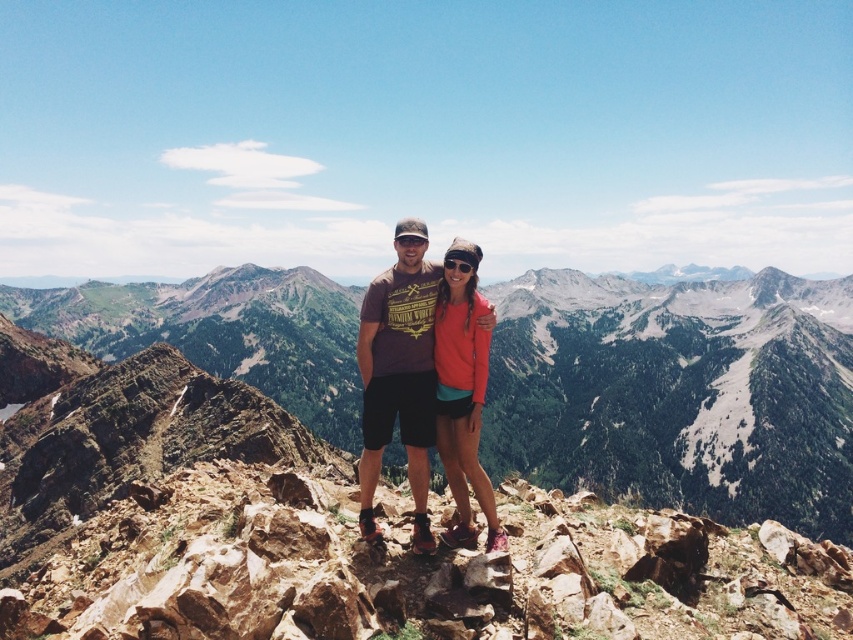
Question: Can you confirm if matte brown t-shirt at center is positioned to the left of orange fleece jacket at center?

Choices:
 (A) yes
 (B) no

Answer: (A)

Question: Does green grassy mountain at center have a smaller size compared to orange fleece jacket at center?

Choices:
 (A) no
 (B) yes

Answer: (A)

Question: From the image, what is the correct spatial relationship of green grassy mountain at center in relation to orange fleece jacket at center?

Choices:
 (A) above
 (B) below

Answer: (A)

Question: Which point is closer to the camera?

Choices:
 (A) (419, 548)
 (B) (445, 356)

Answer: (A)

Question: Which object appears farthest from the camera in this image?

Choices:
 (A) matte brown t-shirt at center
 (B) orange fleece jacket at center

Answer: (A)

Question: Which of these objects is positioned closest to the green grassy mountain at center?

Choices:
 (A) orange fleece jacket at center
 (B) matte brown t-shirt at center

Answer: (A)